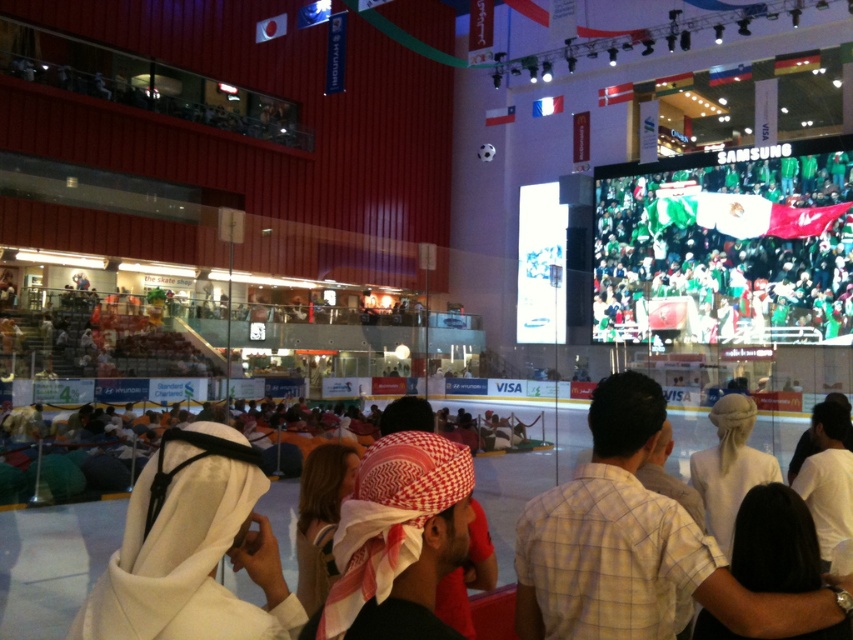
Question: Observing the image, what is the correct spatial positioning of green fabric crowd at upper center in reference to red checkered headscarf at center?

Choices:
 (A) above
 (B) below

Answer: (A)

Question: Among these points, which one is farthest from the camera?

Choices:
 (A) (241, 541)
 (B) (839, 243)

Answer: (B)

Question: Is green fabric crowd at upper center thinner than light brown checkered shirt at center?

Choices:
 (A) yes
 (B) no

Answer: (B)

Question: Estimate the real-world distances between objects in this image. Which object is closer to the green fabric crowd at upper center?

Choices:
 (A) red checkered headscarf at center
 (B) white cloth headscarf at lower left

Answer: (A)

Question: Which point appears closest to the camera in this image?

Choices:
 (A) (289, 600)
 (B) (654, 317)
 (C) (601, 582)

Answer: (A)

Question: Is green fabric crowd at upper center to the left of white cloth headscarf at lower left from the viewer's perspective?

Choices:
 (A) no
 (B) yes

Answer: (A)